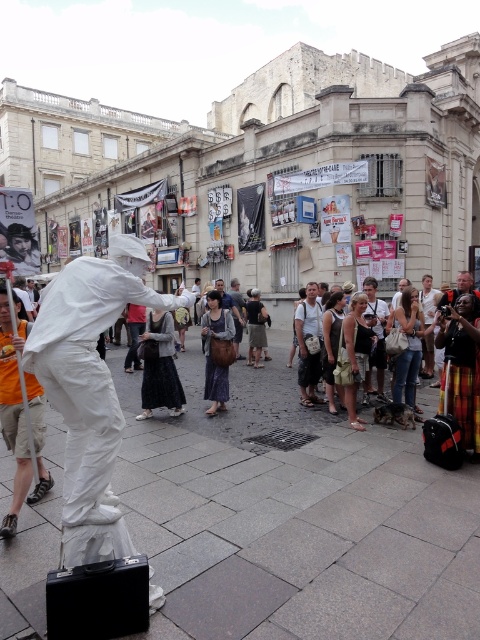
Question: Is dark grey fabric dress at center thinner than white cotton shirt at center?

Choices:
 (A) yes
 (B) no

Answer: (B)

Question: Which object is positioned farthest from the white matte suit at center?

Choices:
 (A) brown woven dress at center
 (B) white cotton shirt at center

Answer: (B)

Question: Which object is the closest to the brown woven dress at center?

Choices:
 (A) white cotton shirt at center
 (B) dark grey fabric dress at center
 (C) white matte suit at center

Answer: (B)

Question: Does white matte suit at center have a greater width compared to dark grey fabric dress at center?

Choices:
 (A) yes
 (B) no

Answer: (A)

Question: Can you confirm if dark grey fabric dress at center is positioned above white cotton shirt at center?

Choices:
 (A) yes
 (B) no

Answer: (B)

Question: Which of these objects is positioned closest to the white cotton shirt at center?

Choices:
 (A) dark grey fabric dress at center
 (B) brown woven dress at center
 (C) white matte suit at center

Answer: (B)